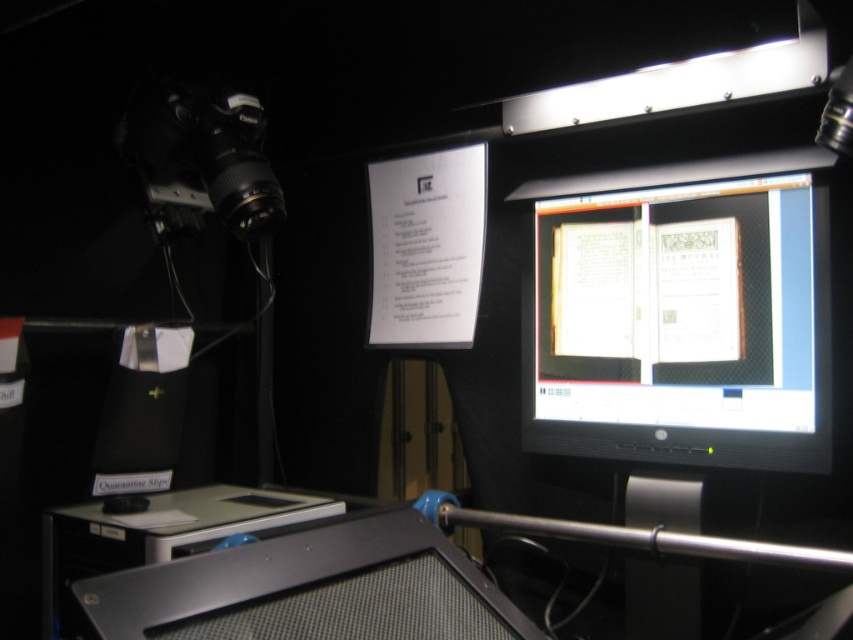
Question: Which point is closer to the camera taking this photo?

Choices:
 (A) (416, 556)
 (B) (175, 148)
 (C) (212, 486)

Answer: (A)

Question: Which point is closer to the camera taking this photo?

Choices:
 (A) (236, 522)
 (B) (579, 326)
 (C) (260, 561)
 (D) (213, 138)

Answer: (C)

Question: Considering the real-world distances, which object is farthest from the matte black monitor at center?

Choices:
 (A) black plastic video camera at upper left
 (B) silver metallic table at lower left
 (C) silver metallic desktop computer at lower center

Answer: (B)

Question: Can you confirm if matte black monitor at center is smaller than silver metallic desktop computer at lower center?

Choices:
 (A) no
 (B) yes

Answer: (A)

Question: Does silver metallic desktop computer at lower center have a greater width compared to silver metallic table at lower left?

Choices:
 (A) yes
 (B) no

Answer: (B)

Question: Is matte black monitor at center below silver metallic table at lower left?

Choices:
 (A) no
 (B) yes

Answer: (A)